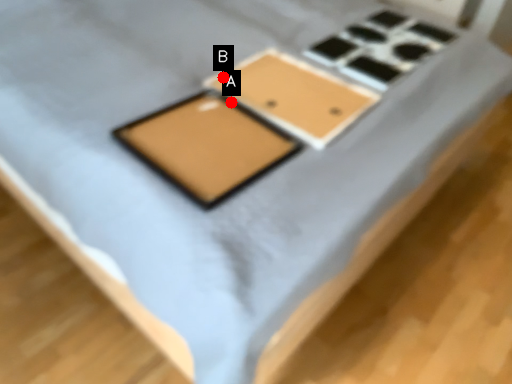
Question: Two points are circled on the image, labeled by A and B beside each circle. Which point is farther to the camera?

Choices:
 (A) A is further
 (B) B is further

Answer: (B)